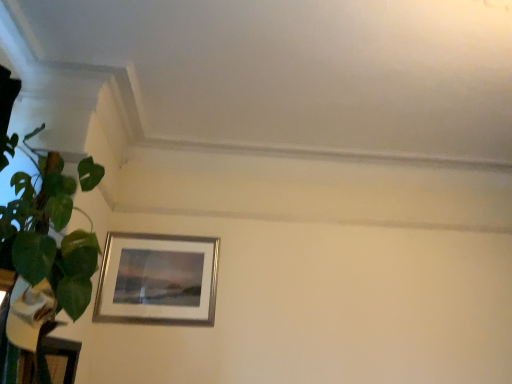
Measure the distance between silver metallic picture frame at lower left and camera.

The distance of silver metallic picture frame at lower left from camera is 8.64 feet.

The image size is (512, 384). Find the location of `silver metallic picture frame at lower left`. silver metallic picture frame at lower left is located at coordinates (157, 280).

Image resolution: width=512 pixels, height=384 pixels. What do you see at coordinates (157, 280) in the screenshot? I see `silver metallic picture frame at lower left` at bounding box center [157, 280].

The width and height of the screenshot is (512, 384). Find the location of `silver metallic picture frame at lower left`. silver metallic picture frame at lower left is located at coordinates (157, 280).